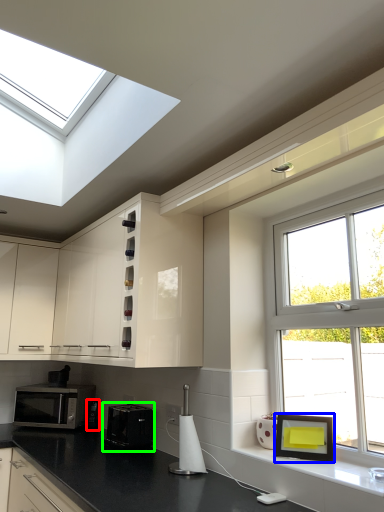
Question: Which object is positioned closest to appliance (highlighted by a red box)? Select from picture frame (highlighted by a blue box) and appliance (highlighted by a green box).

Choices:
 (A) picture frame
 (B) appliance

Answer: (B)